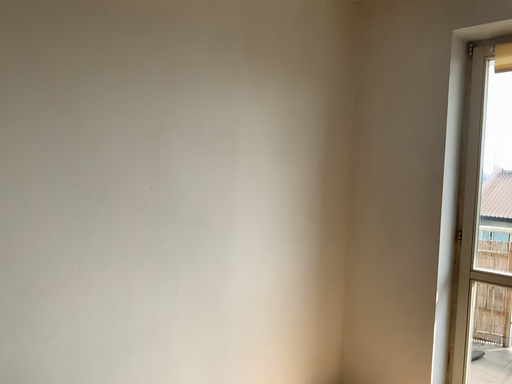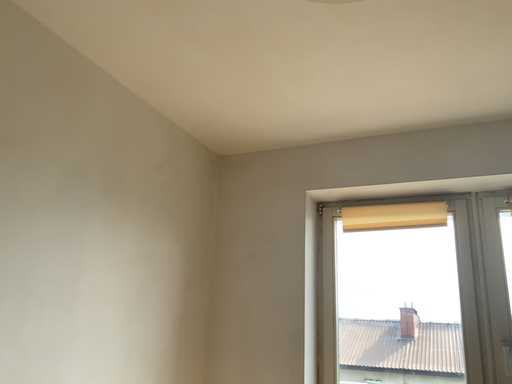
Question: Which way did the camera rotate in the video?

Choices:
 (A) rotated downward
 (B) rotated upward

Answer: (B)